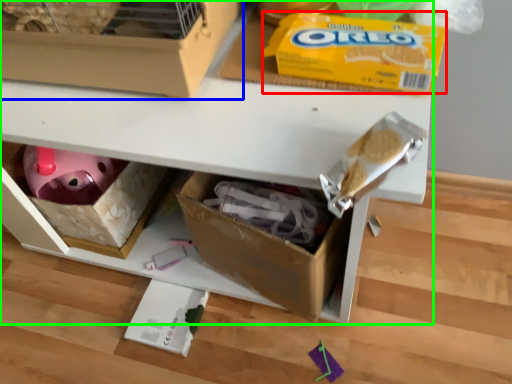
Question: Which object is the farthest from cereal (highlighted by a red box)? Choose among these: box (highlighted by a blue box) or shelf (highlighted by a green box).

Choices:
 (A) box
 (B) shelf

Answer: (B)